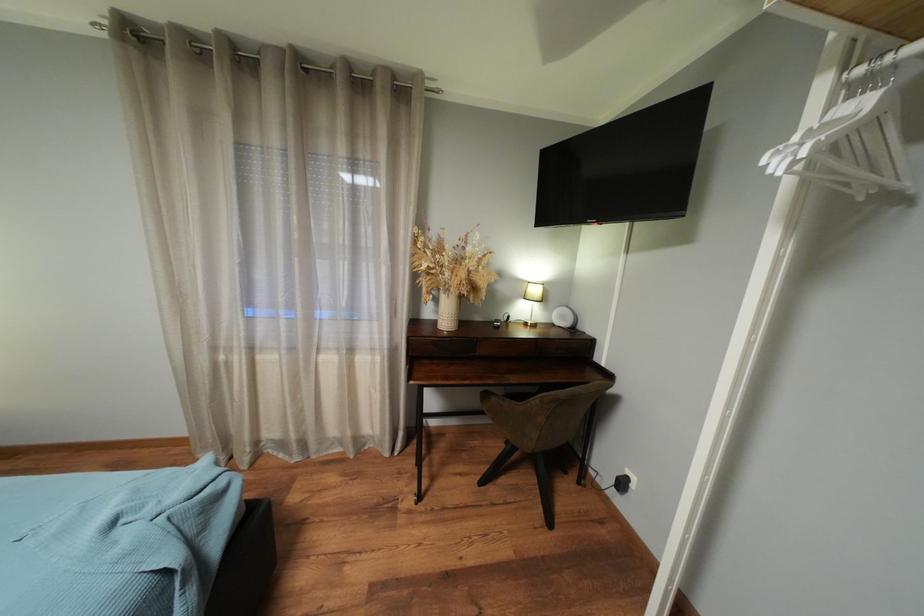
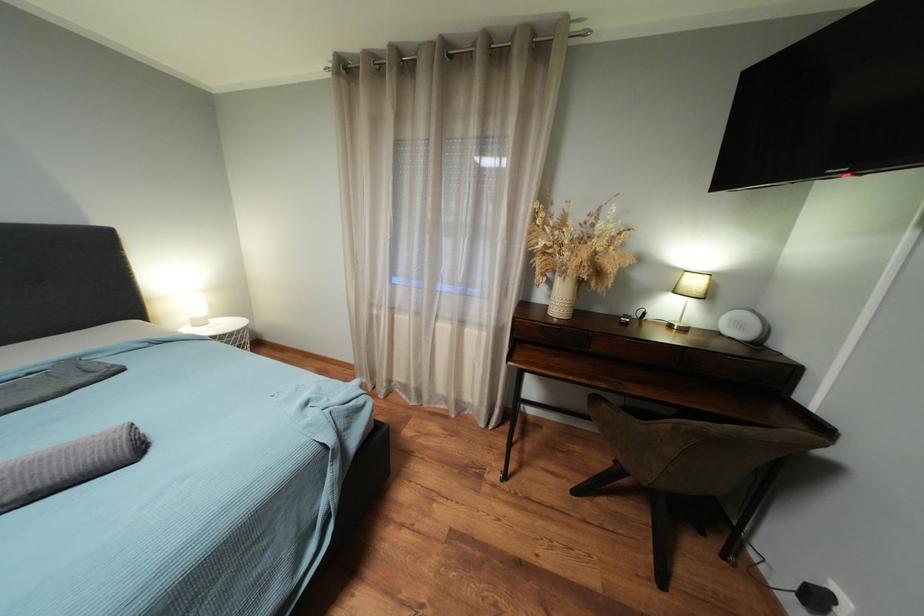
What movement of the cameraman would produce the second image?

The cameraman moved toward right, forward.